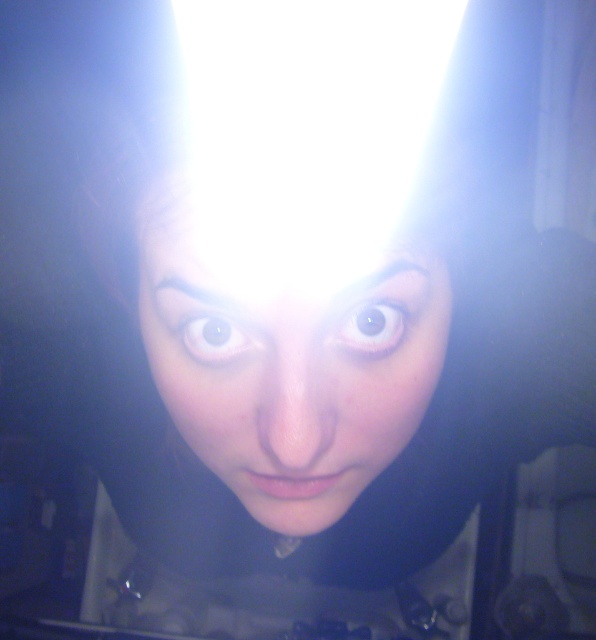
You are a photographer trying to adjust the lighting for a portrait. You notice the smooth skin face at center in the image. Based on the distance between the face and the viewer, what is the minimum distance you should place a reflector to avoid harsh shadows?

The smooth skin face at center and viewer are 37.73 centimeters apart. To avoid harsh shadows, the reflector should be placed at least 37.73 centimeters away from the face.

Based on the scene description, can you determine which object is wider between the smooth skin face at center and the brown glossy eye at center?

The smooth skin face at center is wider than the brown glossy eye at center according to the description.